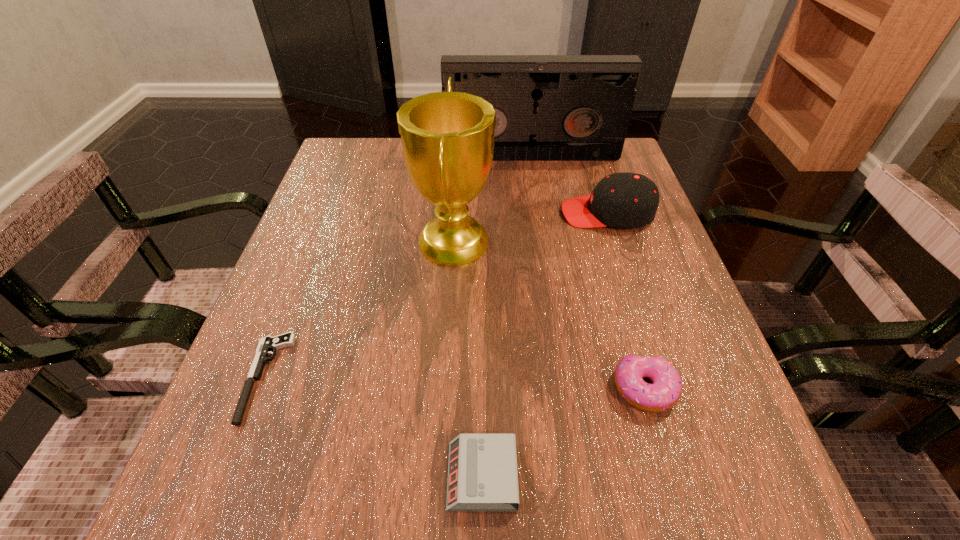
Where is `object that is the fifth closest to the tallest object`? object that is the fifth closest to the tallest object is located at coordinates (482, 470).

Identify the location of vacant area in the image that satisfies the following two spatial constraints: 1. on the front-facing side of the leftmost object; 2. on the right side of the third shortest object. The height and width of the screenshot is (540, 960). (260, 389).

The width and height of the screenshot is (960, 540). In order to click on free space that satisfies the following two spatial constraints: 1. on the front-facing side of the shortest object; 2. on the back side of the nearest object in this screenshot , I will do `click(228, 476)`.

This screenshot has height=540, width=960. In order to click on free spot that satisfies the following two spatial constraints: 1. on the shiny surface of the award; 2. on the left side of the alarm clock in this screenshot , I will do `click(439, 476)`.

The image size is (960, 540). In order to click on vacant area in the image that satisfies the following two spatial constraints: 1. on the front side of the videotape; 2. on the shiny surface of the tallest object in this screenshot , I will do `click(544, 240)`.

In order to click on free space that satisfies the following two spatial constraints: 1. on the front side of the videotape; 2. on the front-facing side of the leftmost object in this screenshot , I will do `click(565, 377)`.

Locate an element on the screen. free space in the image that satisfies the following two spatial constraints: 1. on the front side of the videotape; 2. on the shiny surface of the award is located at coordinates (544, 240).

The height and width of the screenshot is (540, 960). In order to click on blank area in the image that satisfies the following two spatial constraints: 1. on the front side of the farthest object; 2. on the shiny surface of the tallest object in this screenshot , I will do `click(544, 240)`.

At what (x,y) coordinates should I click in order to perform the action: click on blank space that satisfies the following two spatial constraints: 1. on the front side of the fourth tallest object; 2. on the left side of the second tallest object. Please return your answer as a coordinate pair (x, y). Looking at the image, I should click on coord(567,389).